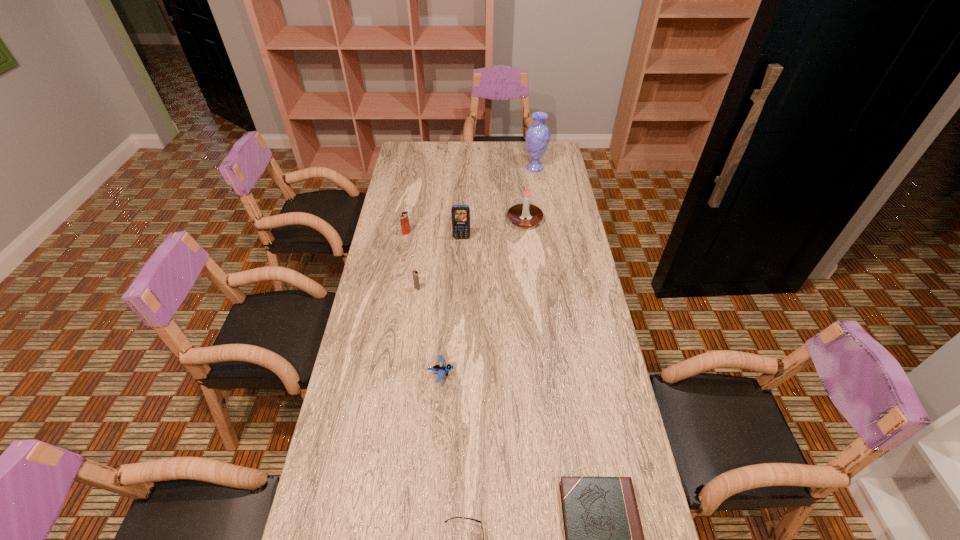
You are a GUI agent. You are given a task and a screenshot of the screen. Output one action in this format:
    pyautogui.click(x=<x>, y=<y>)
    Task: Click on the farthest object
    This screenshot has height=540, width=960.
    Given the screenshot: What is the action you would take?
    click(537, 136)

Where is `the tallest object`? the tallest object is located at coordinates pos(537,136).

Locate an element on the screen. Image resolution: width=960 pixels, height=540 pixels. the fifth nearest object is located at coordinates (460, 214).

Identify the location of candle. tap(517, 213).

Identify the location of the taller igniter. The width and height of the screenshot is (960, 540). [x=404, y=219].

This screenshot has width=960, height=540. In order to click on the farther igniter in this screenshot , I will do `click(404, 219)`.

The height and width of the screenshot is (540, 960). What are the coordinates of `the right igniter` in the screenshot? It's located at (415, 273).

This screenshot has width=960, height=540. In order to click on the seventh object from right to left in this screenshot , I will do `click(415, 273)`.

The width and height of the screenshot is (960, 540). What are the coordinates of `Lego` in the screenshot? It's located at (440, 369).

In order to click on the sixth farthest object in this screenshot , I will do `click(440, 369)`.